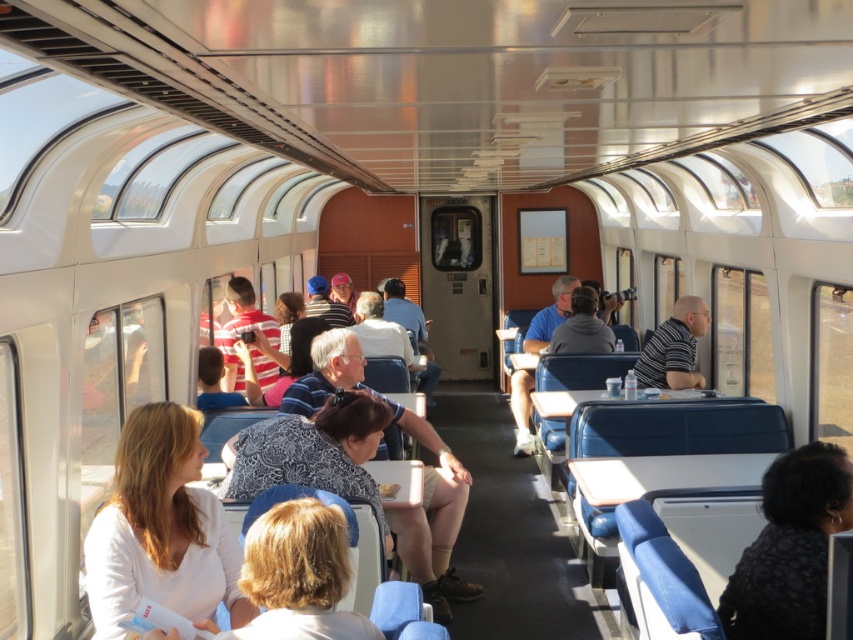
Question: Where is black textured shirt at lower right located in relation to striped cotton shirt at center in the image?

Choices:
 (A) below
 (B) above

Answer: (A)

Question: Can you confirm if white matte shirt at lower left is positioned to the right of black textured shirt at lower right?

Choices:
 (A) no
 (B) yes

Answer: (A)

Question: Which point is closer to the camera?

Choices:
 (A) black textured shirt at lower right
 (B) striped cotton shirt at center

Answer: (A)

Question: Which object is farther from the camera taking this photo?

Choices:
 (A) white matte shirt at lower left
 (B) black textured shirt at lower right
 (C) striped cotton shirt at center

Answer: (C)

Question: Which point is closer to the camera?

Choices:
 (A) (646, 381)
 (B) (801, 449)
 (C) (112, 502)

Answer: (C)

Question: Does white matte shirt at lower left have a smaller size compared to striped cotton shirt at center?

Choices:
 (A) yes
 (B) no

Answer: (A)